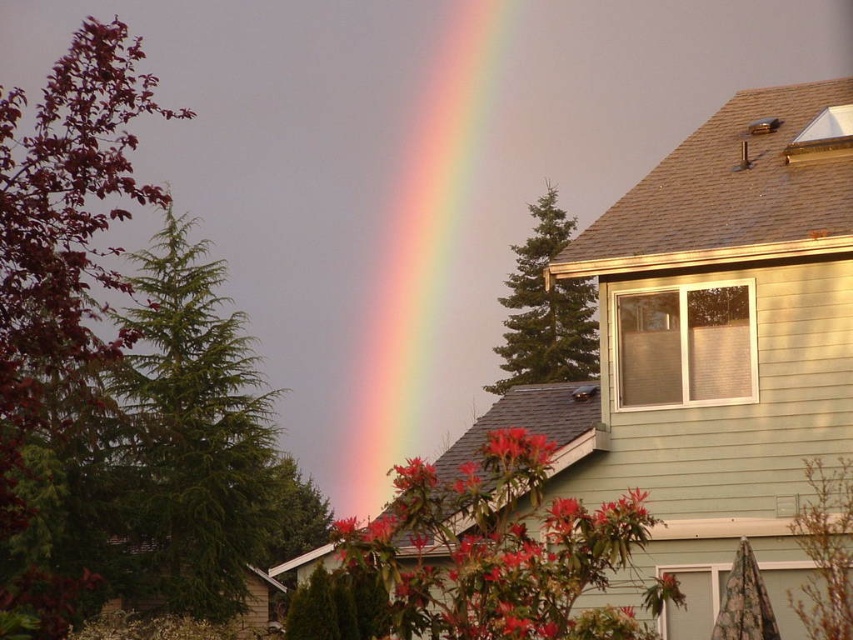
You are standing in the suburban scene and want to walk from the house on the right to the point marked by point (x=450, y=100). However, there is an obstacle at point (x=524, y=449). Will you need to go around the obstacle to reach your destination?

Since point (x=450, y=100) is behind point (x=524, y=449), you will need to go around the obstacle at point (x=524, y=449) to reach the destination at point (x=450, y=100).

You are standing in the suburban scene and want to take a photo of the red matte flower at center without the rainbow at center appearing in the shot. How should you adjust your camera angle?

Since the red matte flower at center is positioned under the rainbow at center, you can lower your camera angle to frame the flower while avoiding the rainbow above it.